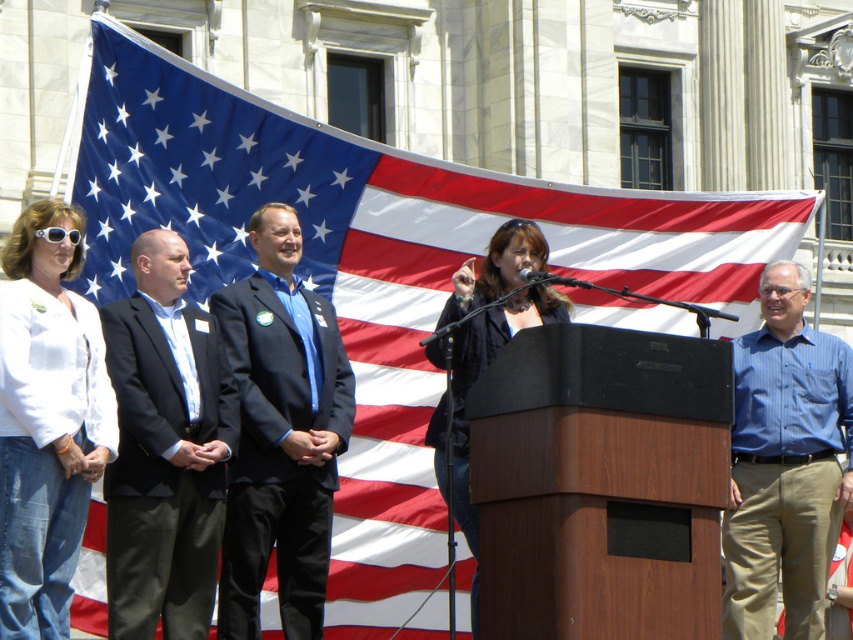
Which is above, denim jacket at center or white plastic goggles at upper left?

white plastic goggles at upper left is higher up.

Can you confirm if denim jacket at center is smaller than white plastic goggles at upper left?

Indeed, denim jacket at center has a smaller size compared to white plastic goggles at upper left.

Which is in front, point (434, 346) or point (76, 232)?

Positioned in front is point (76, 232).

The height and width of the screenshot is (640, 853). What are the coordinates of `denim jacket at center` in the screenshot? It's located at (466, 392).

Is the position of black suit at center more distant than that of white plastic goggles at upper left?

Yes, it is behind white plastic goggles at upper left.

Between black suit at center and white plastic goggles at upper left, which one has more height?

black suit at center

Image resolution: width=853 pixels, height=640 pixels. What do you see at coordinates (165, 449) in the screenshot?
I see `black suit at center` at bounding box center [165, 449].

I want to click on black suit at center, so click(165, 449).

Who is higher up, white cotton shirt at upper left or white plastic goggles at upper left?

Positioned higher is white plastic goggles at upper left.

Locate an element on the screen. This screenshot has height=640, width=853. white cotton shirt at upper left is located at coordinates (45, 422).

What do you see at coordinates (45, 422) in the screenshot? The image size is (853, 640). I see `white cotton shirt at upper left` at bounding box center [45, 422].

Locate an element on the screen. The height and width of the screenshot is (640, 853). white cotton shirt at upper left is located at coordinates (45, 422).